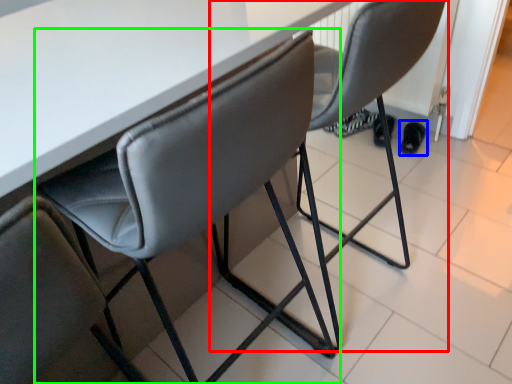
Question: Which object is the farthest from chair (highlighted by a red box)? Choose among these: footwear (highlighted by a blue box) or chair (highlighted by a green box).

Choices:
 (A) footwear
 (B) chair

Answer: (A)